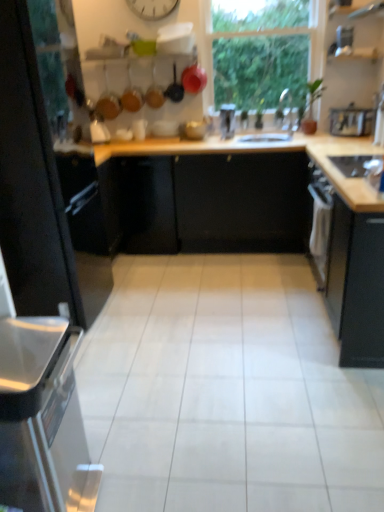
Question: From the image's perspective, is transparent glass window at upper center below white glossy kettle at upper left, the 2th appliance when ordered from bottom to top?

Choices:
 (A) yes
 (B) no

Answer: (B)

Question: Is transparent glass window at upper center to the left of white glossy kettle at upper left, the 1th appliance positioned from the back, from the viewer's perspective?

Choices:
 (A) yes
 (B) no

Answer: (B)

Question: From the image's perspective, is transparent glass window at upper center on white glossy kettle at upper left, acting as the fourth appliance starting from the top?

Choices:
 (A) yes
 (B) no

Answer: (A)

Question: Is transparent glass window at upper center at the right side of white glossy kettle at upper left, acting as the fourth appliance starting from the top?

Choices:
 (A) no
 (B) yes

Answer: (B)

Question: Is transparent glass window at upper center wider than white glossy kettle at upper left, the 2th appliance when ordered from bottom to top?

Choices:
 (A) yes
 (B) no

Answer: (B)

Question: Does transparent glass window at upper center have a lesser height compared to white glossy kettle at upper left, acting as the fourth appliance starting from the top?

Choices:
 (A) no
 (B) yes

Answer: (A)

Question: Could you tell me if matte black frying pan at upper center, the third frying pan from the left, is facing black matte cabinet at left, which ranks as the 1th cabinetry in left-to-right order?

Choices:
 (A) yes
 (B) no

Answer: (B)

Question: Is matte black frying pan at upper center, the 1th frying pan in the right-to-left sequence, shorter than black matte cabinet at left, which ranks as the 1th cabinetry in left-to-right order?

Choices:
 (A) yes
 (B) no

Answer: (A)

Question: Can you confirm if matte black frying pan at upper center, the 1th frying pan in the right-to-left sequence, is smaller than black matte cabinet at left, which ranks as the 1th cabinetry in left-to-right order?

Choices:
 (A) yes
 (B) no

Answer: (A)

Question: From a real-world perspective, is matte black frying pan at upper center, the third frying pan from the left, under black matte cabinet at left, the second cabinetry in the right-to-left sequence?

Choices:
 (A) no
 (B) yes

Answer: (A)

Question: From a real-world perspective, is matte black frying pan at upper center, the 1th frying pan in the right-to-left sequence, on black matte cabinet at left, which ranks as the 1th cabinetry in left-to-right order?

Choices:
 (A) yes
 (B) no

Answer: (A)

Question: Considering the relative sizes of matte black frying pan at upper center, the 1th frying pan in the right-to-left sequence, and black matte cabinet at left, which ranks as the 1th cabinetry in left-to-right order, in the image provided, is matte black frying pan at upper center, the 1th frying pan in the right-to-left sequence, wider than black matte cabinet at left, which ranks as the 1th cabinetry in left-to-right order,?

Choices:
 (A) yes
 (B) no

Answer: (B)

Question: Does black matte cabinet at right, which is the 2th cabinetry in left-to-right order, appear on the right side of matte black frying pan at upper center, the third frying pan from the left?

Choices:
 (A) no
 (B) yes

Answer: (B)